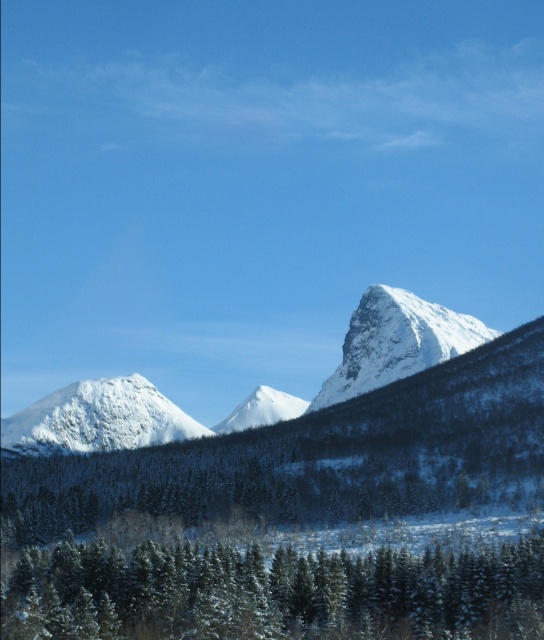
Based on the photo, you are standing at the origin point of the coordinate system in the winter landscape. The snowy evergreen trees at center are located at point 0.927, 0.504. If you want to walk directly towards them, which direction should you head?

The snowy evergreen trees at center are located at coordinate point (274, 593), so you should head towards the direction of increasing x and y coordinates to reach them.